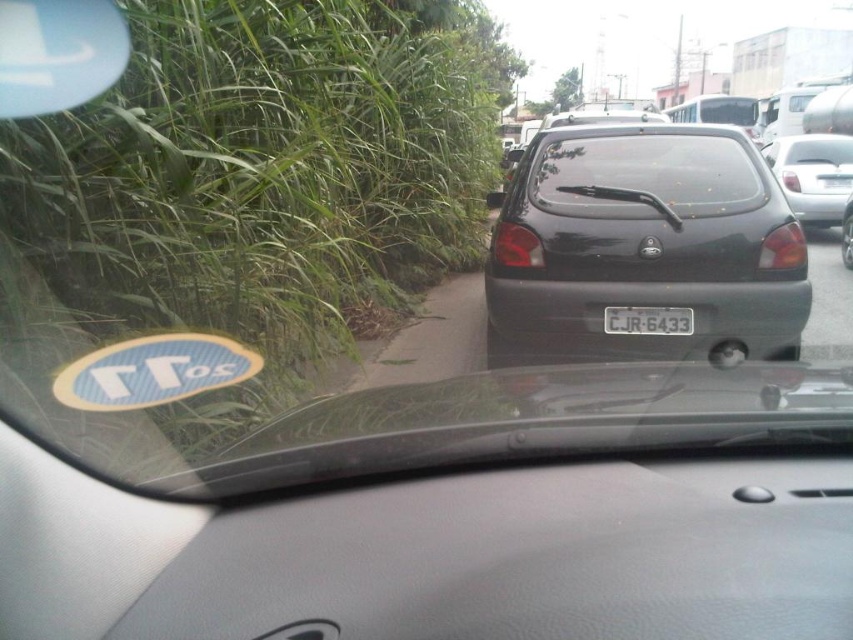
Question: Is matte black hatchback at center below white plastic license plate at center?

Choices:
 (A) no
 (B) yes

Answer: (A)

Question: Can you confirm if matte black hatchback at center is bigger than transparent glass windshield at center?

Choices:
 (A) yes
 (B) no

Answer: (A)

Question: Which of the following is the farthest from the observer?

Choices:
 (A) (612, 182)
 (B) (811, 212)
 (C) (634, 321)
 (D) (689, 209)

Answer: (B)

Question: Based on their relative distances, which object is nearer to the white plastic license plate at center?

Choices:
 (A) black matte hatchback at right
 (B) matte black hatchback at center
 (C) green grass at upper left

Answer: (B)

Question: Which is farther from the black matte hatchback at right?

Choices:
 (A) white plastic license plate at center
 (B) green grass at upper left

Answer: (B)

Question: Does green grass at upper left appear on the right side of transparent glass windshield at center?

Choices:
 (A) yes
 (B) no

Answer: (B)